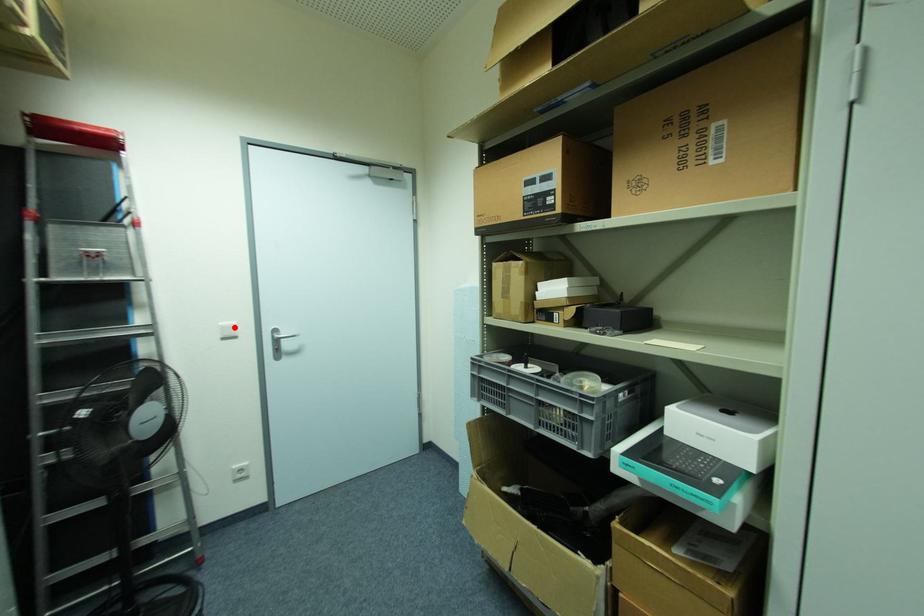
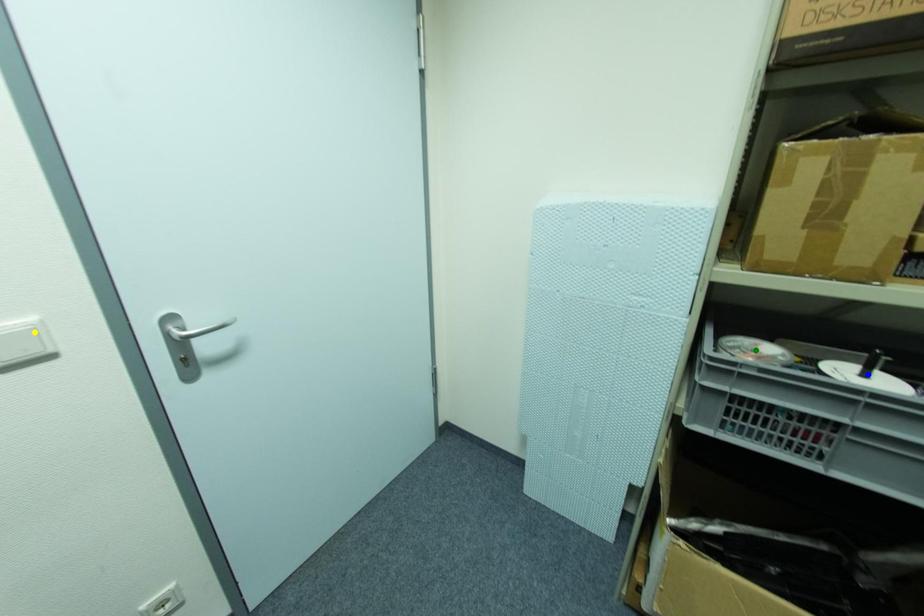
Question: I am providing you with two images of the same scene from different viewpoints. A red point is marked on the first image. You are given multiple points on the second image. Which spot in image 2 lines up with the point in image 1?

Choices:
 (A) yellow point
 (B) blue point
 (C) green point

Answer: (A)